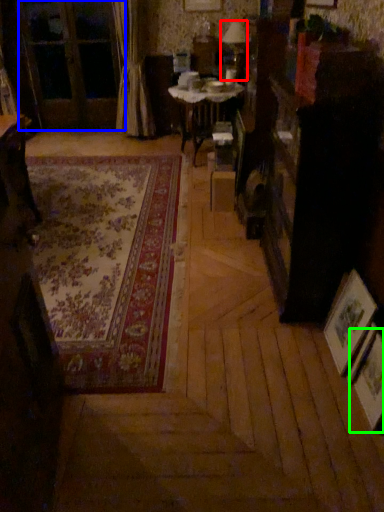
Question: Considering the real-world distances, which object is closest to table lamp (highlighted by a red box)? screen door (highlighted by a blue box) or picture frame (highlighted by a green box).

Choices:
 (A) screen door
 (B) picture frame

Answer: (A)